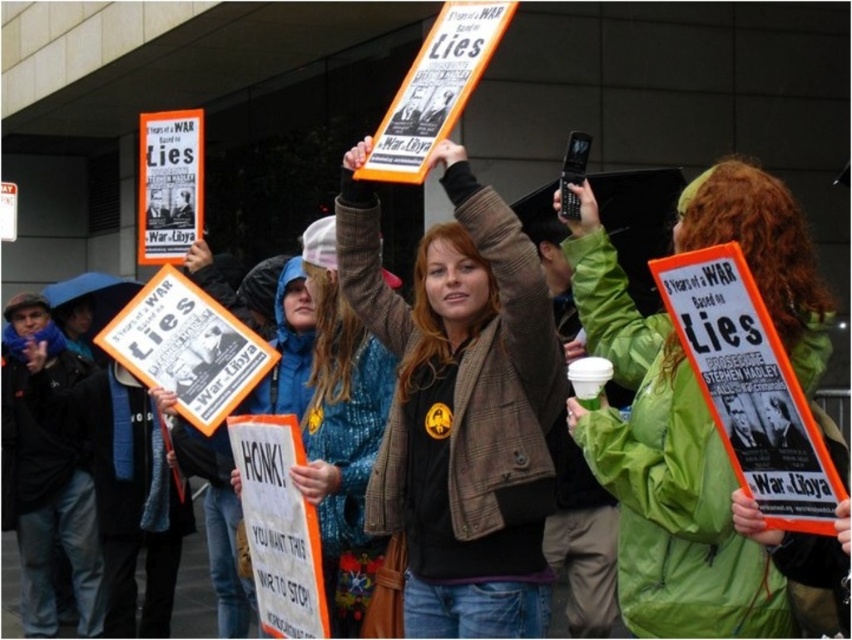
Which of these two, matte orange sign at center or green waterproof jacket at center, stands taller?

With more height is matte orange sign at center.

Does matte orange sign at center have a larger size compared to green waterproof jacket at center?

Yes.

You are a GUI agent. You are given a task and a screenshot of the screen. Output one action in this format:
    pyautogui.click(x=<x>, y=<y>)
    Task: Click on the matte orange sign at center
    
    Given the screenshot: What is the action you would take?
    pyautogui.click(x=461, y=406)